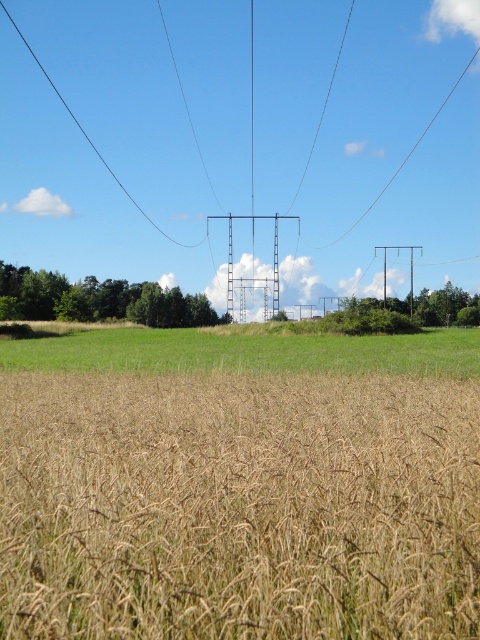
Question: Can you confirm if green grass at center is smaller than green leafy tree at right?

Choices:
 (A) yes
 (B) no

Answer: (A)

Question: Among these objects, which one is nearest to the camera?

Choices:
 (A) green leafy tree at lower left
 (B) green grass at center
 (C) brown matte wheat field at center
 (D) green leafy tree at right

Answer: (C)

Question: Which object is the farthest from the brown matte wheat field at center?

Choices:
 (A) green leafy tree at lower left
 (B) green leafy tree at right
 (C) green grass at center

Answer: (A)

Question: Among these objects, which one is nearest to the camera?

Choices:
 (A) green leafy tree at right
 (B) green leafy tree at lower left
 (C) green grass at center
 (D) brown matte wheat field at center

Answer: (D)

Question: Does green grass at center lie in front of green leafy tree at right?

Choices:
 (A) no
 (B) yes

Answer: (B)

Question: Can you confirm if brown matte wheat field at center is positioned to the right of green grass at center?

Choices:
 (A) yes
 (B) no

Answer: (B)